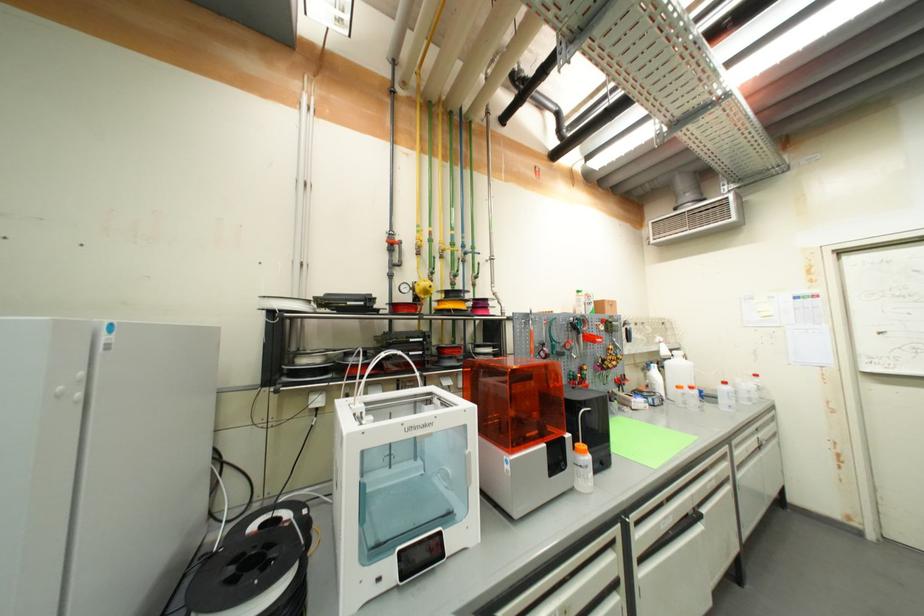
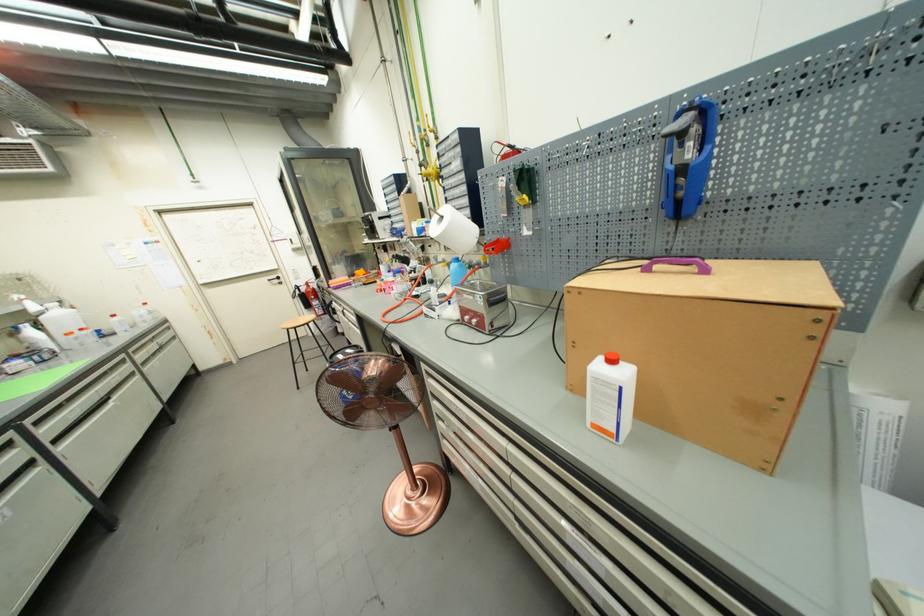
The point at [641,556] is marked in the first image. Where is the corresponding point in the second image?

(52, 440)